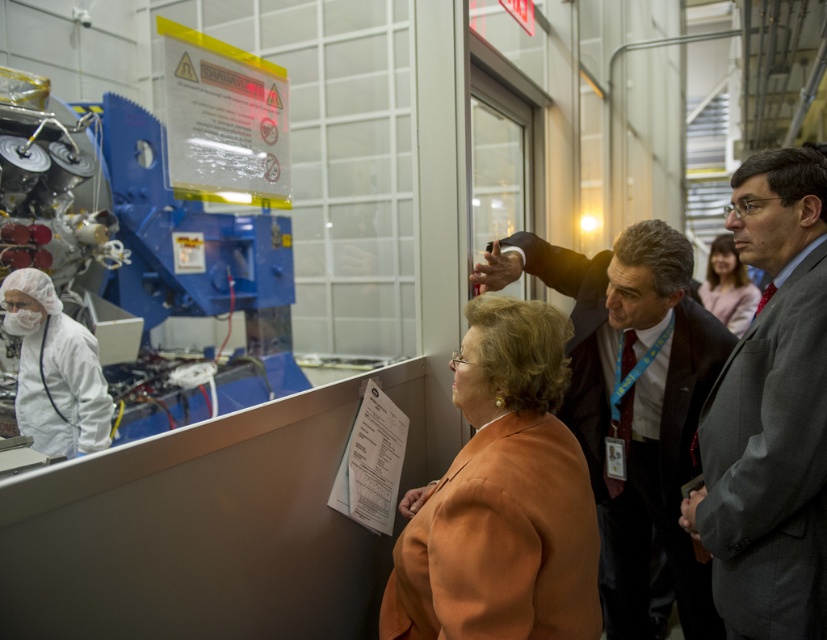
Question: Is orange fabric jacket at center wider than matte orange blazer at center?

Choices:
 (A) no
 (B) yes

Answer: (A)

Question: Considering the real-world distances, which object is closest to the matte orange blazer at center?

Choices:
 (A) gray suit at center
 (B) orange fabric jacket at center
 (C) dark suit at center

Answer: (C)

Question: Observing the image, what is the correct spatial positioning of orange fabric jacket at center in reference to gray suit at center?

Choices:
 (A) left
 (B) right

Answer: (A)

Question: Which is farther from the gray suit at center?

Choices:
 (A) orange fabric jacket at center
 (B) matte orange blazer at center

Answer: (B)

Question: Considering the real-world distances, which object is closest to the gray suit at center?

Choices:
 (A) orange fabric jacket at center
 (B) dark suit at center
 (C) matte orange blazer at center

Answer: (B)

Question: Is gray suit at center to the right of dark suit at center from the viewer's perspective?

Choices:
 (A) no
 (B) yes

Answer: (B)